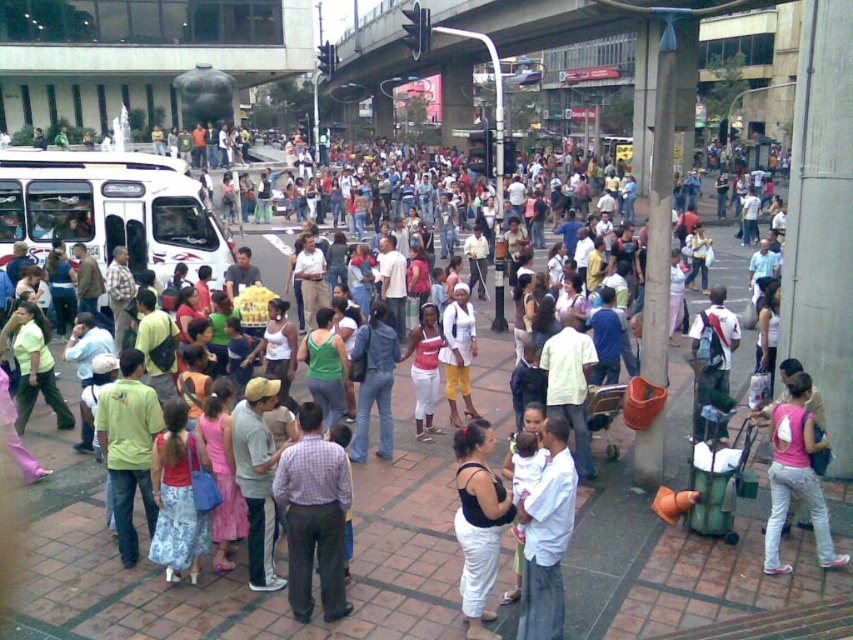
You are a photographer trying to capture a candid shot of the crowd in the urban square. You notice a person wearing a white cotton shirt at center and another carrying a pink fabric bag at center. Since you want to focus on the narrower object, which one should you zoom in on?

The white cotton shirt at center has a lesser width compared to the pink fabric bag at center, so you should zoom in on the white cotton shirt at center to focus on the narrower object.

Consider the image. You are a photographer standing in the crowd at the plaza. You notice a person wearing a white cotton shirt at center and yellow cotton pants at center. Which piece of clothing is closer to your camera lens?

The white cotton shirt at center is closer to the camera lens because it is in front of the yellow cotton shirt at center.